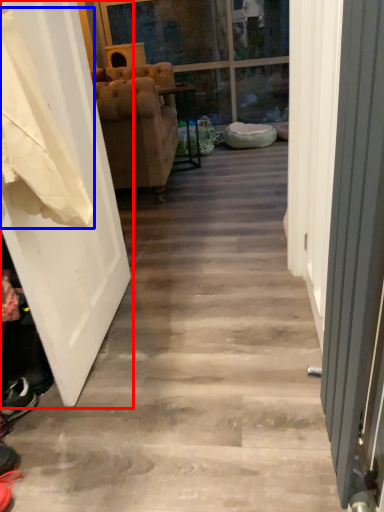
Question: Among these objects, which one is nearest to the camera, door (highlighted by a red box) or laundry (highlighted by a blue box)?

Choices:
 (A) door
 (B) laundry

Answer: (B)